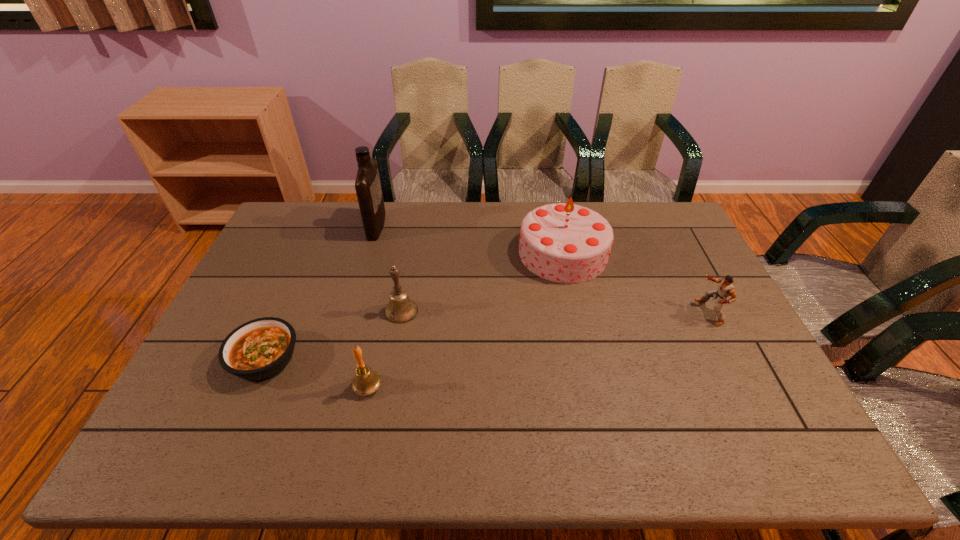
The width and height of the screenshot is (960, 540). I want to click on the tallest object, so click(368, 188).

In order to click on the fifth object from right to left in this screenshot , I will do `click(368, 188)`.

Find the location of a particular element. The width and height of the screenshot is (960, 540). the fifth object from left to right is located at coordinates (563, 242).

The height and width of the screenshot is (540, 960). Identify the location of the fifth shortest object. (563, 242).

Find the location of a particular element. the farther bell is located at coordinates (401, 309).

Identify the location of the nearer bell. (366, 381).

This screenshot has height=540, width=960. In order to click on the rightmost object in this screenshot , I will do `click(726, 288)`.

You are a GUI agent. You are given a task and a screenshot of the screen. Output one action in this format:
    pyautogui.click(x=<x>, y=<y>)
    Task: Click on the shortest object
    
    Given the screenshot: What is the action you would take?
    pyautogui.click(x=258, y=350)

The image size is (960, 540). I want to click on the leftmost object, so click(258, 350).

Where is `free space located on the label side of the liquor`? Image resolution: width=960 pixels, height=540 pixels. free space located on the label side of the liquor is located at coordinates (442, 226).